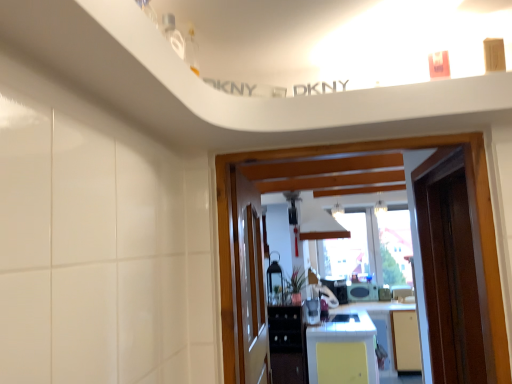
Question: Which is correct: matte black microwave at center, which is the fourth appliance from left to right, is inside metallic lantern at center, the 1th appliance in the left-to-right sequence, or outside of it?

Choices:
 (A) outside
 (B) inside

Answer: (A)

Question: Considering the positions of matte black microwave at center, which is the fourth appliance from left to right, and metallic lantern at center, the 1th appliance in the left-to-right sequence, in the image, is matte black microwave at center, which is the fourth appliance from left to right, taller or shorter than metallic lantern at center, the 1th appliance in the left-to-right sequence,?

Choices:
 (A) short
 (B) tall

Answer: (A)

Question: Which of these objects is positioned closest to the metallic silver toaster at center, which is the first appliance in front-to-back order?

Choices:
 (A) matte black microwave at center, which is the fourth appliance from left to right
 (B) yellow matte countertop at center
 (C) black glossy cabinet at center
 (D) metallic lantern at center, the second appliance viewed from the front
 (E) wooden door at center, the 1th door viewed from the left

Answer: (C)

Question: Considering the real-world distances, which object is closest to the white glossy exhaust hood at upper center?

Choices:
 (A) matte black microwave at center, the first appliance viewed from the back
 (B) brown wooden door at right, acting as the 1th door starting from the right
 (C) yellow matte countertop at center
 (D) metallic silver toaster at center, marked as the 3th appliance in a left-to-right arrangement
 (E) metallic silver toaster at center, which is the first appliance in front-to-back order

Answer: (D)